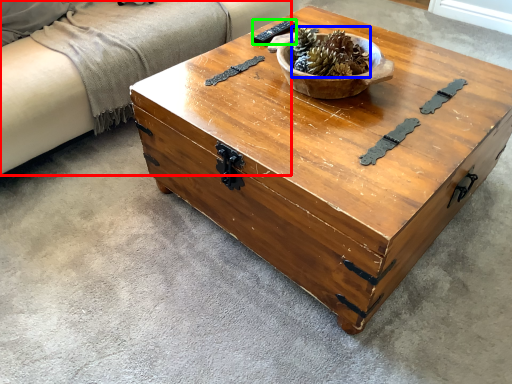
Question: Which object is the closest to the couch (highlighted by a red box)? Choose among these: centerpiece (highlighted by a blue box) or remote (highlighted by a green box).

Choices:
 (A) centerpiece
 (B) remote

Answer: (B)